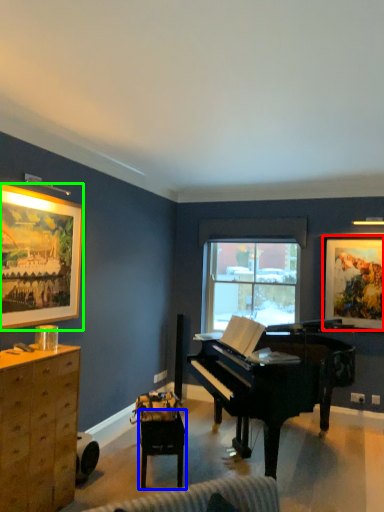
Question: Estimate the real-world distances between objects in this image. Which object is farther from picture frame (highlighted by a red box), table (highlighted by a blue box) or picture frame (highlighted by a green box)?

Choices:
 (A) table
 (B) picture frame

Answer: (B)